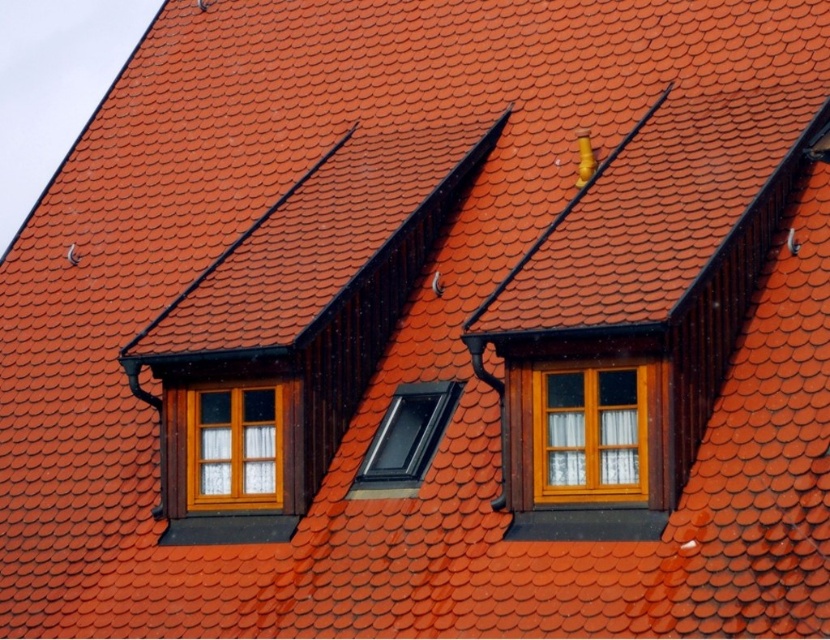
Can you confirm if matte wood window at center is shorter than transparent plastic skylight at center?

In fact, matte wood window at center may be taller than transparent plastic skylight at center.

Which of these two, matte wood window at center or transparent plastic skylight at center, stands taller?

matte wood window at center is taller.

Is point (581, 493) more distant than point (370, 442)?

No, (581, 493) is closer to viewer.

The image size is (830, 640). In order to click on matte wood window at center in this screenshot , I will do `click(589, 435)`.

What do you see at coordinates (589, 435) in the screenshot? The width and height of the screenshot is (830, 640). I see `matte wood window at center` at bounding box center [589, 435].

Is point (588, 474) positioned before point (213, 428)?

Yes, point (588, 474) is in front of point (213, 428).

Find the location of `matte wood window at center`. matte wood window at center is located at coordinates (589, 435).

Does wooden window at center have a larger size compared to transparent plastic skylight at center?

No, wooden window at center is not bigger than transparent plastic skylight at center.

Which is in front, point (198, 464) or point (359, 493)?

Point (359, 493) is more forward.

Identify the location of wooden window at center. (233, 449).